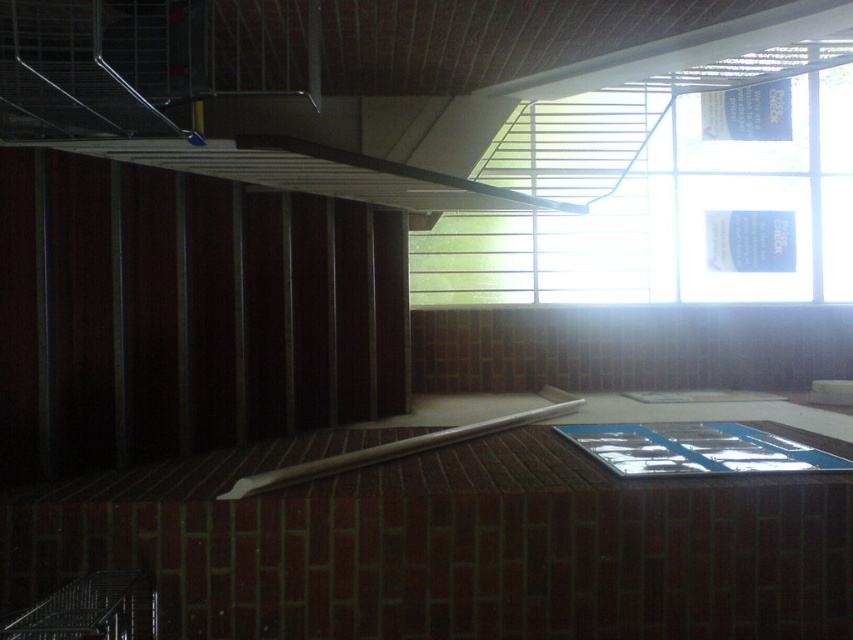
Is clear glass window at upper right positioned at the back of white wood beam at center?

Yes.

Is clear glass window at upper right to the left of white wood beam at center from the viewer's perspective?

No, clear glass window at upper right is not to the left of white wood beam at center.

Does point (782, 157) lie behind point (251, 486)?

Yes, it is.

At what (x,y) coordinates should I click in order to perform the action: click on clear glass window at upper right. Please return your answer as a coordinate pair (x, y). This screenshot has width=853, height=640. Looking at the image, I should click on (657, 195).